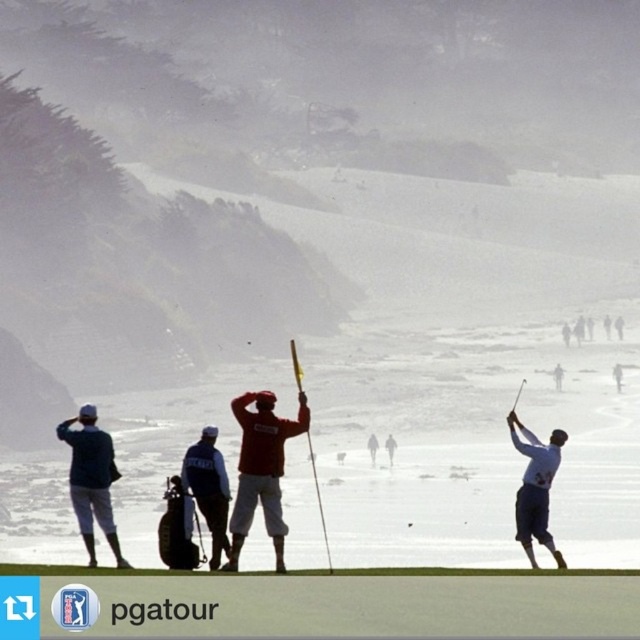
Does red cotton shirt at center have a larger size compared to white matte golf club at right?

Incorrect, red cotton shirt at center is not larger than white matte golf club at right.

The height and width of the screenshot is (640, 640). I want to click on red cotton shirt at center, so click(260, 468).

Does green turf at center appear on the right side of denim pants at left?

Yes, green turf at center is to the right of denim pants at left.

Is point (611, 596) less distant than point (77, 522)?

That is True.

Is point (576, 612) positioned behind point (80, 452)?

No, (576, 612) is closer to viewer.

Where is `green turf at center`? green turf at center is located at coordinates (316, 604).

Describe the element at coordinates (92, 480) in the screenshot. I see `denim pants at left` at that location.

Can you confirm if denim pants at left is positioned to the right of dark blue fabric jacket at center?

In fact, denim pants at left is to the left of dark blue fabric jacket at center.

Describe the element at coordinates (92, 480) in the screenshot. I see `denim pants at left` at that location.

Locate an element on the screen. The image size is (640, 640). denim pants at left is located at coordinates (92, 480).